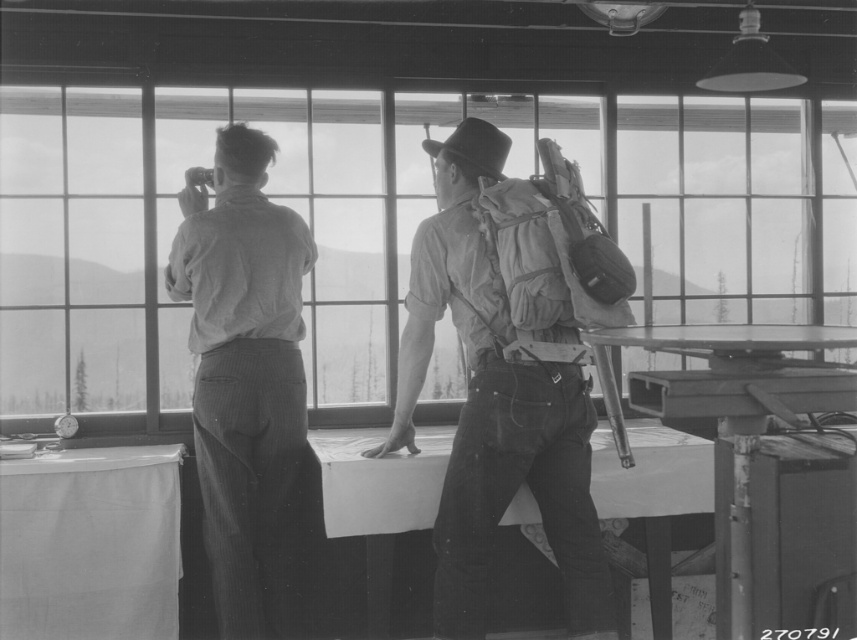
Question: Can you confirm if smooth gray shirt at left is positioned to the right of smooth wood table at center?

Choices:
 (A) yes
 (B) no

Answer: (B)

Question: Which object appears farthest from the camera in this image?

Choices:
 (A) black felt cowboy hat at upper center
 (B) smooth gray shirt at left

Answer: (B)

Question: Is canvas backpack at center positioned at the back of black felt cowboy hat at upper center?

Choices:
 (A) yes
 (B) no

Answer: (B)

Question: Which object is closer to the camera taking this photo?

Choices:
 (A) smooth wood table at center
 (B) white fabric table at lower left
 (C) canvas backpack at center
 (D) smooth gray shirt at left

Answer: (C)

Question: Does smooth gray shirt at left appear over metallic gray table at right?

Choices:
 (A) no
 (B) yes

Answer: (B)

Question: Estimate the real-world distances between objects in this image. Which object is farther from the canvas backpack at center?

Choices:
 (A) black felt cowboy hat at upper center
 (B) metallic gray table at right

Answer: (B)